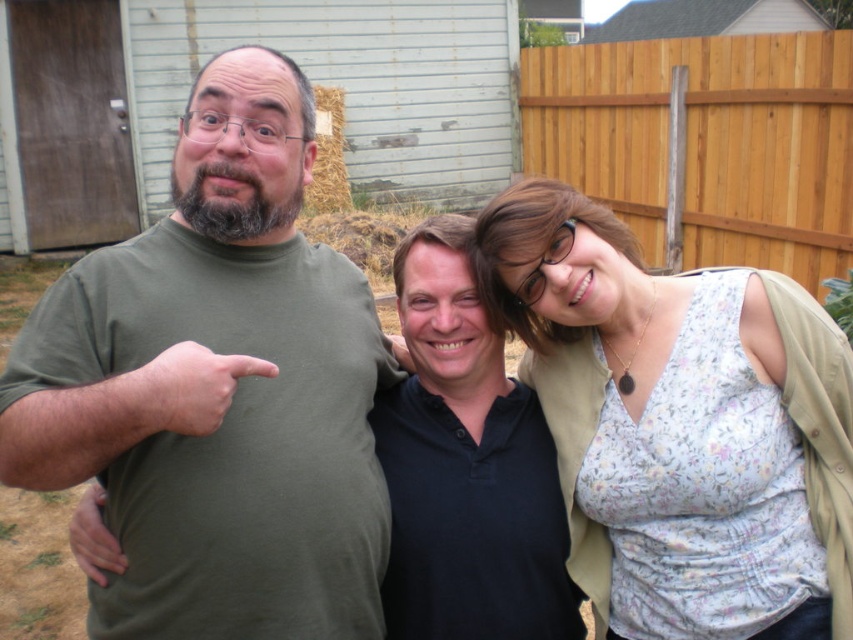
Question: Does green matte t-shirt at left appear on the left side of floral fabric blouse at upper right?

Choices:
 (A) yes
 (B) no

Answer: (A)

Question: Can you confirm if green matte t-shirt at left is wider than wooden fence at upper right?

Choices:
 (A) yes
 (B) no

Answer: (B)

Question: Which of these objects is positioned closest to the floral fabric blouse at upper right?

Choices:
 (A) green matte shirt at left
 (B) green matte t-shirt at left
 (C) wooden fence at upper right

Answer: (A)

Question: Which object is the farthest from the floral fabric blouse at upper right?

Choices:
 (A) green matte t-shirt at left
 (B) green matte shirt at left

Answer: (A)

Question: Does floral fabric blouse at upper right have a greater width compared to green matte shirt at left?

Choices:
 (A) yes
 (B) no

Answer: (B)

Question: Which object is farther from the camera taking this photo?

Choices:
 (A) wooden fence at upper right
 (B) floral fabric blouse at upper right
 (C) green matte shirt at left

Answer: (A)